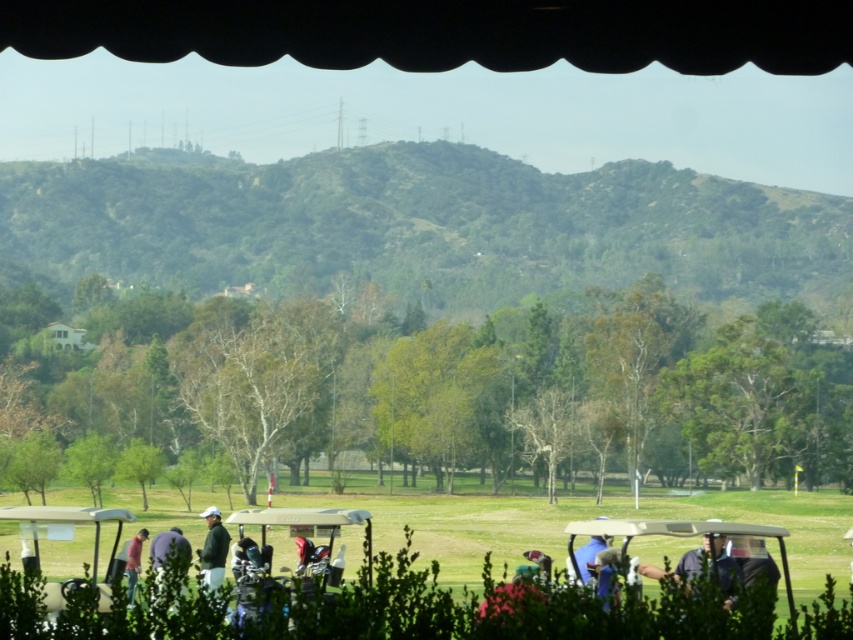
You are a golfer standing at the purple fabric at lower left, which is part of a tent. You want to move to the white plastic golf cart at center. Which direction should you walk to reach it?

You should walk to your right to reach the white plastic golf cart at center because it is located to the right of the purple fabric at lower left.

Consider the image. You are standing at the purple fabric at lower left and want to walk to the green grassy golf course at center. Which direction should you head?

You should head to the right since the green grassy golf course at center is to the right of the purple fabric at lower left.